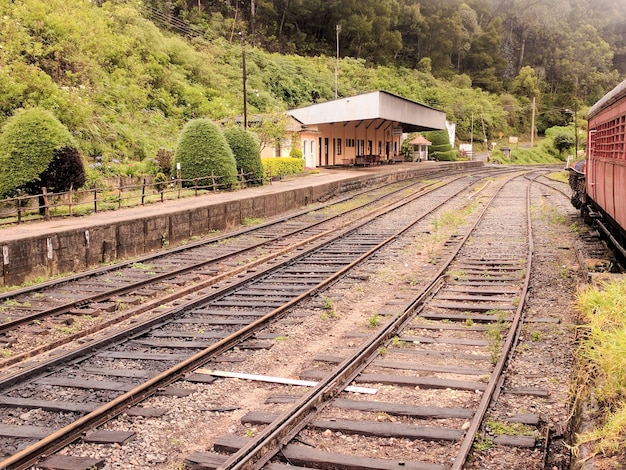
This screenshot has width=626, height=470. In order to click on bench in this screenshot , I will do `click(345, 163)`.